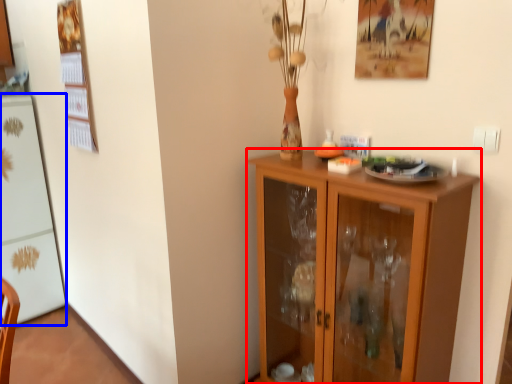
Question: Which of the following is the closest to the observer, cupboard (highlighted by a red box) or appliance (highlighted by a blue box)?

Choices:
 (A) cupboard
 (B) appliance

Answer: (A)